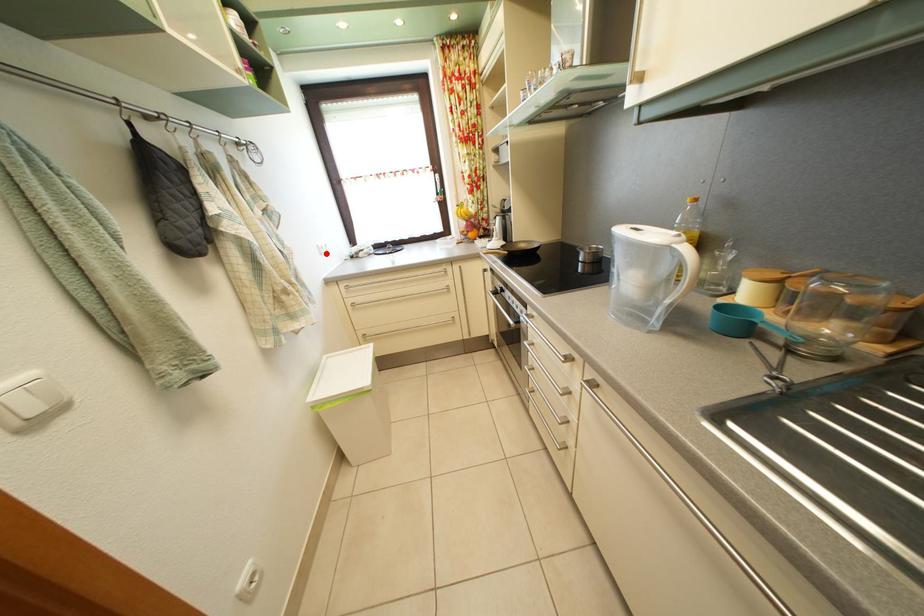
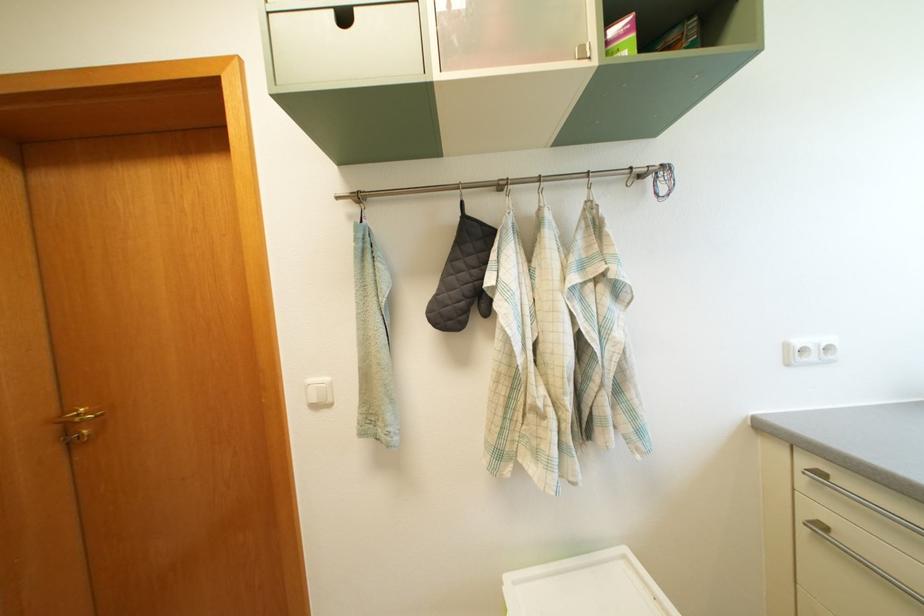
Question: I am providing you with two images of the same scene from different viewpoints. Given a red point in image1, look at the same physical point in image2. Is it:

Choices:
 (A) Closer to the viewpoint
 (B) Farther from the viewpoint

Answer: (B)